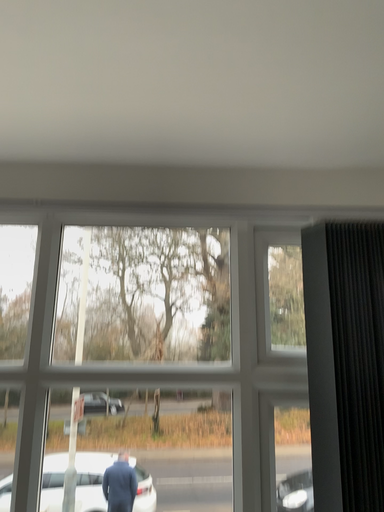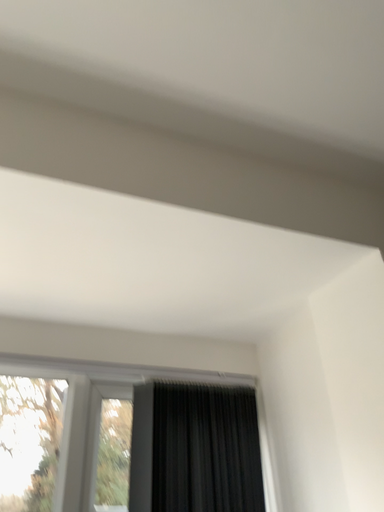
Question: How did the camera likely rotate when shooting the video?

Choices:
 (A) rotated downward
 (B) rotated upward

Answer: (B)